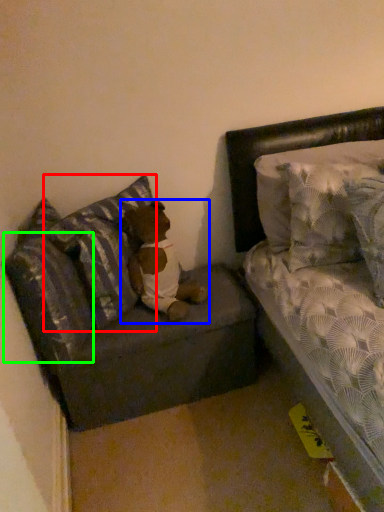
Question: Which is farther away from pillow (highlighted by a red box)? teddy (highlighted by a blue box) or pillow (highlighted by a green box)?

Choices:
 (A) teddy
 (B) pillow

Answer: (B)